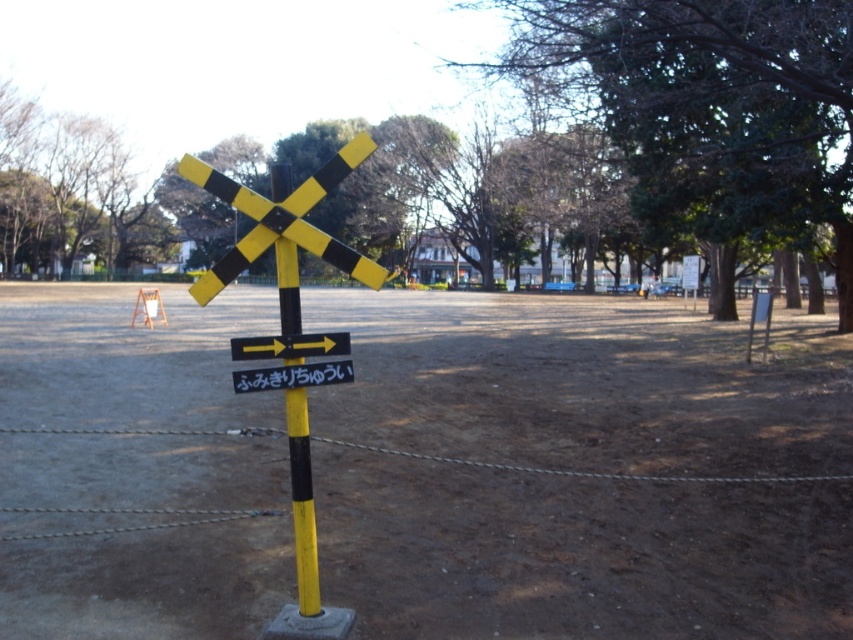
You are a photographer planning to take a landscape photo of the green leafy tree at upper center and the yellow matte pole at center. Since you want both objects to be clearly visible in your photo, which one should you position closer to the camera to ensure it doesn not get obscured?

You should position the green leafy tree at upper center closer to the camera because the yellow matte pole at center is behind it, so moving the tree forward will prevent it from blocking the pole.

From the picture: You are a delivery robot with a 3.5 feet wide package. You need to navigate through the area between the yellow matte pole at center and the yellow plastic arrow at center. Can you pass through this space with your package?

The distance between the yellow matte pole at center and the yellow plastic arrow at center is 4.41 feet, which is wider than your 3.5 feet wide package. Therefore, you can safely pass through the space between them.